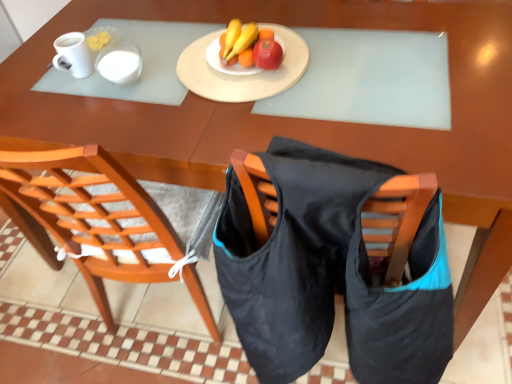
Image resolution: width=512 pixels, height=384 pixels. I want to click on vacant space to the left of white glossy mug at upper left, so point(27,76).